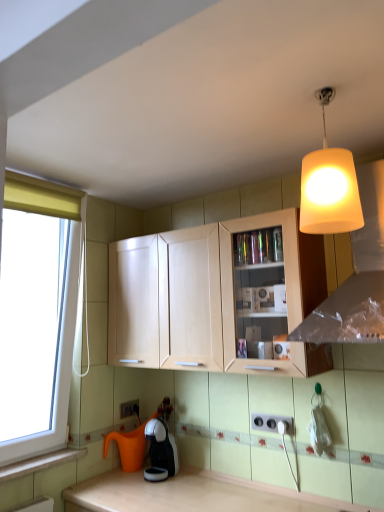
Where is `wooden at lower left`? This screenshot has height=512, width=384. wooden at lower left is located at coordinates (40, 463).

Find the location of a particular element. Image resolution: width=384 pixels, height=512 pixels. matte white lampshade at upper right is located at coordinates (356, 277).

What do you see at coordinates (329, 186) in the screenshot?
I see `matte white lampshade at upper right` at bounding box center [329, 186].

In order to face matte white lampshade at upper right, should I rotate leftwards or rightwards?

Turn right approximately 17.693 degrees to face it.

Where is `white plastic electric outlet at lower center, which is the 1th electric outlet from front to back`? Image resolution: width=384 pixels, height=512 pixels. white plastic electric outlet at lower center, which is the 1th electric outlet from front to back is located at coordinates (271, 423).

Does light wood cabinet at center turn towards white plastic electric outlet at lower center, acting as the second electric outlet starting from the left?

No, light wood cabinet at center does not turn towards white plastic electric outlet at lower center, acting as the second electric outlet starting from the left.

Can you confirm if light wood cabinet at center is bigger than white plastic electric outlet at lower center, the 1th electric outlet from the top?

Correct, light wood cabinet at center is larger in size than white plastic electric outlet at lower center, the 1th electric outlet from the top.

From a real-world perspective, who is located lower, light wood cabinet at center or white plastic electric outlet at lower center, which is the first electric outlet in right-to-left order?

white plastic electric outlet at lower center, which is the first electric outlet in right-to-left order, from a real-world perspective.

Looking at this image, does light wood cabinet at center have a lesser height compared to white plastic electric outlet at lower center, which is counted as the second electric outlet, starting from the back?

Incorrect, the height of light wood cabinet at center does not fall short of that of white plastic electric outlet at lower center, which is counted as the second electric outlet, starting from the back.

Which is more to the left, light wood cabinet at center or black glossy coffee machine at lower center?

black glossy coffee machine at lower center.

In terms of height, does light wood cabinet at center look taller or shorter compared to black glossy coffee machine at lower center?

Considering their sizes, light wood cabinet at center has more height than black glossy coffee machine at lower center.

Is light wood cabinet at center smaller than black glossy coffee machine at lower center?

Actually, light wood cabinet at center might be larger than black glossy coffee machine at lower center.

From the picture: Does matte white lampshade at upper right have a smaller size compared to white plastic electric outlet at lower center, which is counted as the second electric outlet, starting from the back?

No, matte white lampshade at upper right is not smaller than white plastic electric outlet at lower center, which is counted as the second electric outlet, starting from the back.

In the scene shown: Is matte white lampshade at upper right far away from white plastic electric outlet at lower center, the second electric outlet in the bottom-to-top sequence?

Actually, matte white lampshade at upper right and white plastic electric outlet at lower center, the second electric outlet in the bottom-to-top sequence, are a little close together.

Considering the points (362, 233) and (269, 422), which point is in front, point (362, 233) or point (269, 422)?

The point (362, 233) is closer.

From a real-world perspective, is wooden at lower left positioned over white plastic electric outlet at lower center, acting as the second electric outlet starting from the left, based on gravity?

Actually, wooden at lower left is physically below white plastic electric outlet at lower center, acting as the second electric outlet starting from the left, in the real world.

Can you see wooden at lower left touching white plastic electric outlet at lower center, which is counted as the second electric outlet, starting from the back?

wooden at lower left and white plastic electric outlet at lower center, which is counted as the second electric outlet, starting from the back, are clearly separated.

Which is in front, point (16, 462) or point (264, 418)?

The point (16, 462) is in front.

Considering the relative sizes of wooden at lower left and white plastic electric outlet at lower center, the 1th electric outlet from the top, in the image provided, is wooden at lower left smaller than white plastic electric outlet at lower center, the 1th electric outlet from the top,?

Incorrect, wooden at lower left is not smaller in size than white plastic electric outlet at lower center, the 1th electric outlet from the top.

Is matte white lampshade at upper right wider than matte white lampshade at upper right?

Correct, the width of matte white lampshade at upper right exceeds that of matte white lampshade at upper right.

Is matte white lampshade at upper right inside or outside of matte white lampshade at upper right?

matte white lampshade at upper right is spatially situated outside matte white lampshade at upper right.

Who is smaller, matte white lampshade at upper right or matte white lampshade at upper right?

With smaller size is matte white lampshade at upper right.

At what (x,y) coordinates should I click in order to perform the action: click on cabinetry below the matte white lampshade at upper right (from the image's perspective). Please return your answer as a coordinate pair (x, y). The image size is (384, 512). Looking at the image, I should click on point(213,298).

From their relative heights in the image, would you say matte white lampshade at upper right is taller or shorter than light wood cabinet at center?

Clearly, matte white lampshade at upper right is taller compared to light wood cabinet at center.

Is matte white lampshade at upper right facing away from light wood cabinet at center?

No, matte white lampshade at upper right's orientation is not away from light wood cabinet at center.

Would you say matte white lampshade at upper right is a long distance from light wood cabinet at center?

No, there isn't a large distance between matte white lampshade at upper right and light wood cabinet at center.

Does matte white lampshade at upper right contain matte white lampshade at upper right?

No, matte white lampshade at upper right is not surrounded by matte white lampshade at upper right.

Which of these two, matte white lampshade at upper right or matte white lampshade at upper right, is wider?

Wider between the two is matte white lampshade at upper right.

Can you see matte white lampshade at upper right touching matte white lampshade at upper right?

matte white lampshade at upper right is not next to matte white lampshade at upper right, and they're not touching.

Can you confirm if matte white lampshade at upper right is taller than matte white lampshade at upper right?

No.

This screenshot has width=384, height=512. I want to click on the 1st electric outlet below the light wood cabinet at center (from a real-world perspective), so click(271, 423).

Locate an element on the screen. Image resolution: width=384 pixels, height=512 pixels. cabinetry above the black glossy coffee machine at lower center (from the image's perspective) is located at coordinates (213, 298).

When comparing their distances from matte white lampshade at upper right, does white plastic electric outlet at lower center, the second electric outlet in the right-to-left sequence, or white plastic electric outlet at lower center, the second electric outlet in the bottom-to-top sequence, seem closer?

white plastic electric outlet at lower center, the second electric outlet in the bottom-to-top sequence, is closer to matte white lampshade at upper right.

From the image, which object appears to be farther from white plastic electric outlet at lower center, the second electric outlet in the bottom-to-top sequence, wooden at lower left or matte white lampshade at upper right?

Among the two, wooden at lower left is located further to white plastic electric outlet at lower center, the second electric outlet in the bottom-to-top sequence.

Estimate the real-world distances between objects in this image. Which object is closer to white plastic electric outlet at lower center, which is the first electric outlet in right-to-left order, black glossy coffee machine at lower center or matte white lampshade at upper right?

black glossy coffee machine at lower center is positioned closer to the anchor white plastic electric outlet at lower center, which is the first electric outlet in right-to-left order.

Looking at the image, which one is located further to light wood cabinet at center, matte white lampshade at upper right or black glossy coffee machine at lower center?

matte white lampshade at upper right is further to light wood cabinet at center.

Based on the photo, looking at the image, which one is located further to matte white lampshade at upper right, light wood cabinet at center or matte white lampshade at upper right?

light wood cabinet at center lies further to matte white lampshade at upper right than the other object.

Estimate the real-world distances between objects in this image. Which object is further from black glossy coffee machine at lower center, white plastic electric outlet at lower center, positioned as the first electric outlet in back-to-front order, or white plastic electric outlet at lower center, which is the first electric outlet in right-to-left order?

white plastic electric outlet at lower center, which is the first electric outlet in right-to-left order, lies further to black glossy coffee machine at lower center than the other object.

Estimate the real-world distances between objects in this image. Which object is closer to black glossy coffee machine at lower center, white plastic electric outlet at lower center, which is counted as the second electric outlet, starting from the back, or white plastic electric outlet at lower center, the second electric outlet in the right-to-left sequence?

white plastic electric outlet at lower center, the second electric outlet in the right-to-left sequence, is closer to black glossy coffee machine at lower center.

Which object lies further to the anchor point white plastic electric outlet at lower center, marked as the 2th electric outlet in a front-to-back arrangement, matte white lampshade at upper right or black glossy coffee machine at lower center?

matte white lampshade at upper right.

What are the coordinates of `coffee machine located between wooden at lower left and white plastic electric outlet at lower center, arranged as the 1th electric outlet when ordered from the bottom, in the depth direction` in the screenshot? It's located at (162, 446).

Locate an element on the screen. The width and height of the screenshot is (384, 512). cabinetry situated between wooden at lower left and matte white lampshade at upper right from left to right is located at coordinates (213, 298).

Locate an element on the screen. The width and height of the screenshot is (384, 512). cabinetry that lies between matte white lampshade at upper right and white plastic electric outlet at lower center, the second electric outlet in the bottom-to-top sequence, from top to bottom is located at coordinates (213, 298).

Find the location of `window sill between matte white lampshade at upper right and black glossy coffee machine at lower center in the up-down direction`. window sill between matte white lampshade at upper right and black glossy coffee machine at lower center in the up-down direction is located at coordinates (40, 463).